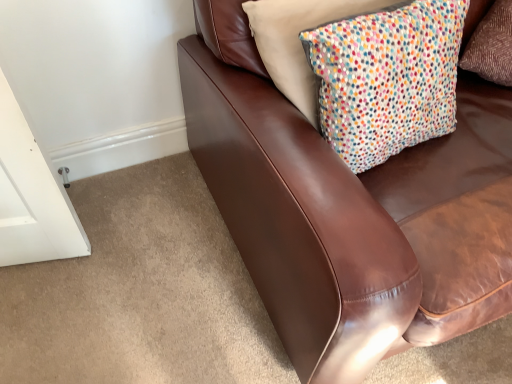
Question: Considering the positions of brown leather couch at upper right and white dotted fabric pillow at upper right in the image, is brown leather couch at upper right wider or thinner than white dotted fabric pillow at upper right?

Choices:
 (A) wide
 (B) thin

Answer: (A)

Question: From a real-world perspective, relative to white dotted fabric pillow at upper right, is brown leather couch at upper right vertically above or below?

Choices:
 (A) below
 (B) above

Answer: (A)

Question: From their relative heights in the image, would you say brown leather couch at upper right is taller or shorter than white dotted fabric pillow at upper right?

Choices:
 (A) tall
 (B) short

Answer: (A)

Question: From their relative heights in the image, would you say white dotted fabric pillow at upper right is taller or shorter than brown leather couch at upper right?

Choices:
 (A) tall
 (B) short

Answer: (B)

Question: Considering the positions of point (376, 81) and point (292, 221), is point (376, 81) closer or farther from the camera than point (292, 221)?

Choices:
 (A) closer
 (B) farther

Answer: (B)

Question: Based on their positions, is white dotted fabric pillow at upper right located to the left or right of brown leather couch at upper right?

Choices:
 (A) left
 (B) right

Answer: (A)

Question: Looking at the image, does white dotted fabric pillow at upper right seem bigger or smaller compared to brown leather couch at upper right?

Choices:
 (A) small
 (B) big

Answer: (A)